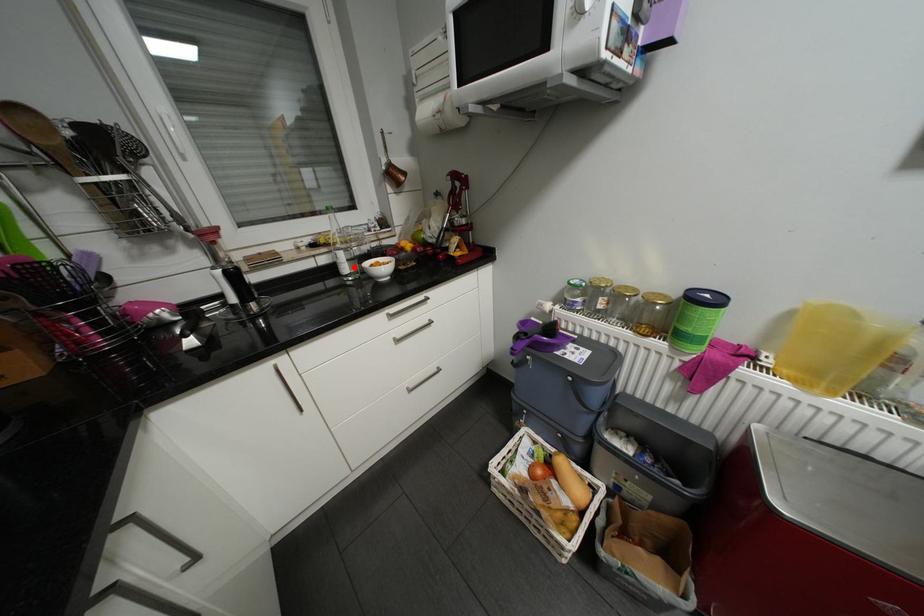
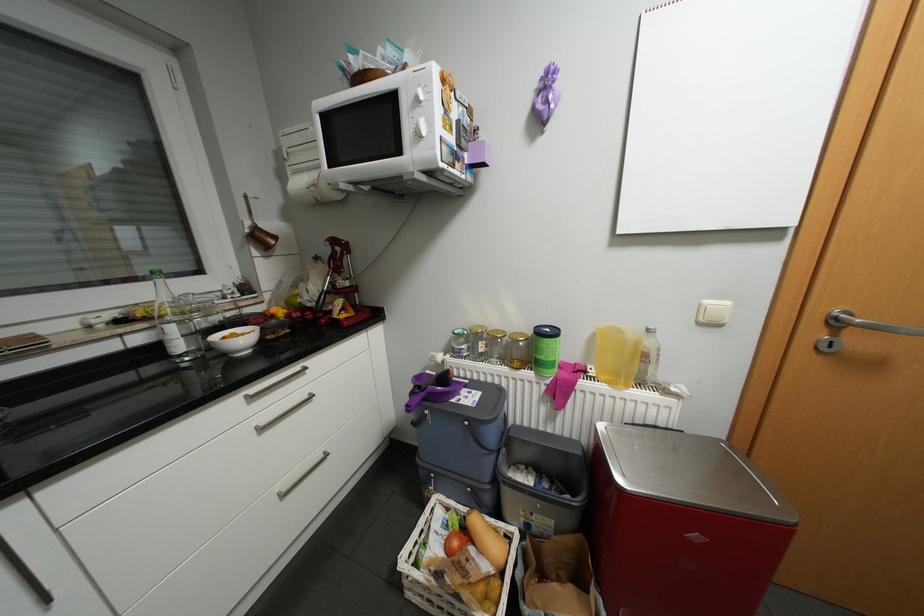
In the second image, find the point that corresponds to the highlighted location in the first image.

(188, 345)